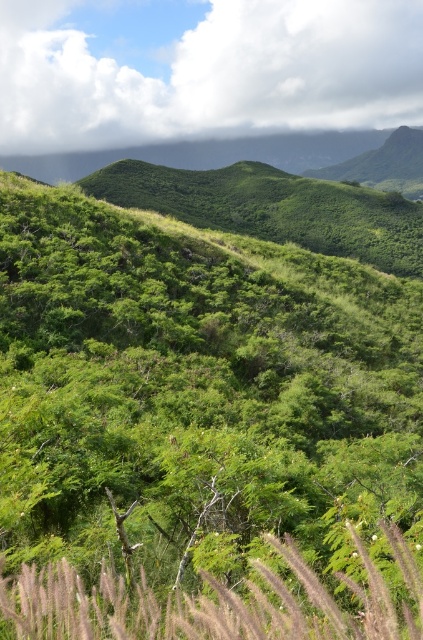
Question: Among these points, which one is farthest from the camera?

Choices:
 (A) (233, 614)
 (B) (244, 241)

Answer: (B)

Question: Is white fluffy cloud at upper center to the right of silvery grass at center from the viewer's perspective?

Choices:
 (A) yes
 (B) no

Answer: (A)

Question: Which point is farther from the camera taking this photo?

Choices:
 (A) (373, 611)
 (B) (0, 500)
 (C) (354, 36)

Answer: (C)

Question: Is green leafy shrub at center thinner than white fluffy cloud at upper center?

Choices:
 (A) yes
 (B) no

Answer: (A)

Question: Is white fluffy cloud at upper center to the left of silvery grass at center from the viewer's perspective?

Choices:
 (A) yes
 (B) no

Answer: (B)

Question: Among these objects, which one is farthest from the camera?

Choices:
 (A) silvery grass at center
 (B) white fluffy cloud at upper center
 (C) green leafy shrub at center

Answer: (B)